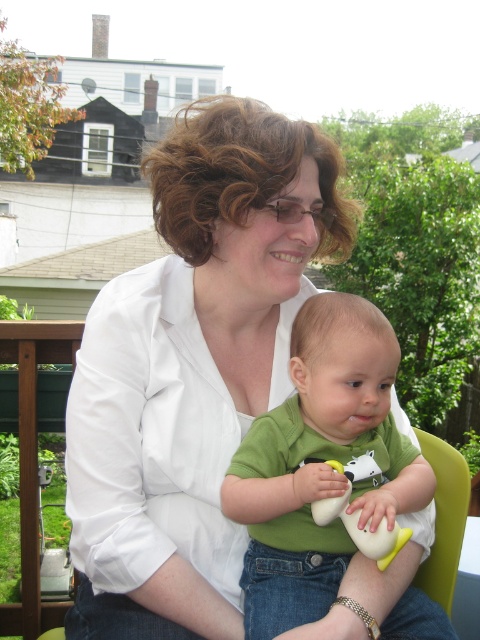
Question: Which object appears closest to the camera in this image?

Choices:
 (A) white smooth shirt at center
 (B) green matte shirt at center

Answer: (B)

Question: Does white smooth shirt at center appear on the right side of white rubber duck at center?

Choices:
 (A) yes
 (B) no

Answer: (B)

Question: Is white smooth shirt at center further to the viewer compared to white rubber duck at center?

Choices:
 (A) no
 (B) yes

Answer: (B)

Question: Does green matte shirt at center have a lesser width compared to white rubber duck at center?

Choices:
 (A) no
 (B) yes

Answer: (A)

Question: Which of the following is the farthest from the observer?

Choices:
 (A) (288, 496)
 (B) (108, 301)

Answer: (B)

Question: Which object is closer to the camera taking this photo?

Choices:
 (A) white smooth shirt at center
 (B) white rubber duck at center

Answer: (B)